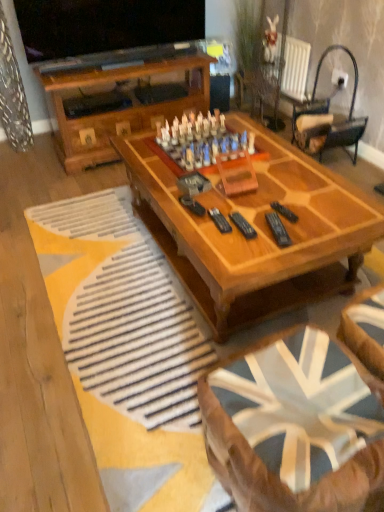
Identify the location of free space to the left of black plastic remote at center, the 3th remote viewed from the left. This screenshot has width=384, height=512. (242, 210).